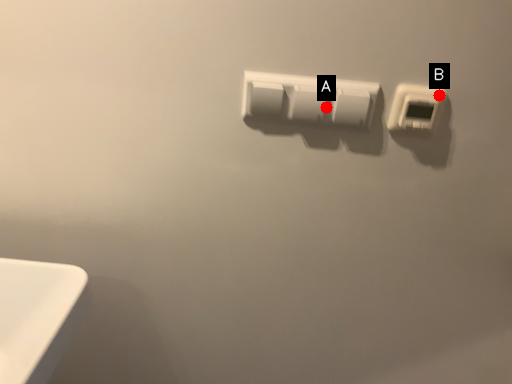
Question: Two points are circled on the image, labeled by A and B beside each circle. Which point appears farthest from the camera in this image?

Choices:
 (A) A is further
 (B) B is further

Answer: (A)